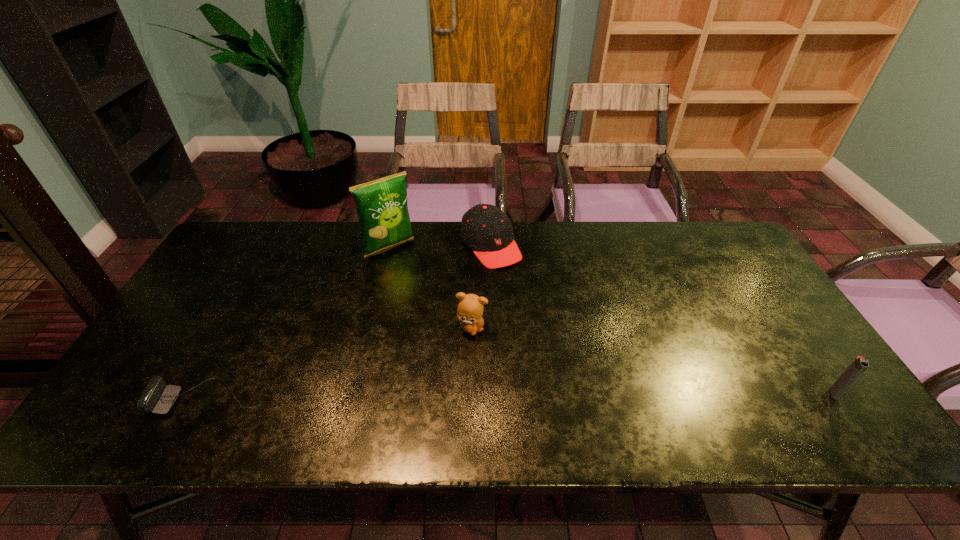
At what (x,y) coordinates should I click in order to perform the action: click on free space between the cap and the crisp (potato chip). Please return your answer as a coordinate pair (x, y). Looking at the image, I should click on (440, 246).

Identify the location of empty space that is in between the webcam and the cap. This screenshot has width=960, height=540. (351, 322).

Locate an element on the screen. This screenshot has height=540, width=960. vacant area that lies between the third nearest object and the crisp (potato chip) is located at coordinates (431, 288).

Find the location of `object that stands as the closest to the second object from left to right`. object that stands as the closest to the second object from left to right is located at coordinates (485, 229).

Image resolution: width=960 pixels, height=540 pixels. I want to click on object that is the second closest to the webcam, so click(x=382, y=208).

Where is `vacant space that satisfies the following two spatial constraints: 1. on the back side of the third nearest object; 2. on the left side of the cap`? This screenshot has width=960, height=540. vacant space that satisfies the following two spatial constraints: 1. on the back side of the third nearest object; 2. on the left side of the cap is located at coordinates (474, 246).

Find the location of a particular element. Image resolution: width=960 pixels, height=540 pixels. vacant area in the image that satisfies the following two spatial constraints: 1. on the front side of the cap; 2. on the right side of the rightmost object is located at coordinates (494, 393).

Locate an element on the screen. The width and height of the screenshot is (960, 540). free space that satisfies the following two spatial constraints: 1. on the front side of the teddy bear; 2. on the left side of the crisp (potato chip) is located at coordinates (370, 328).